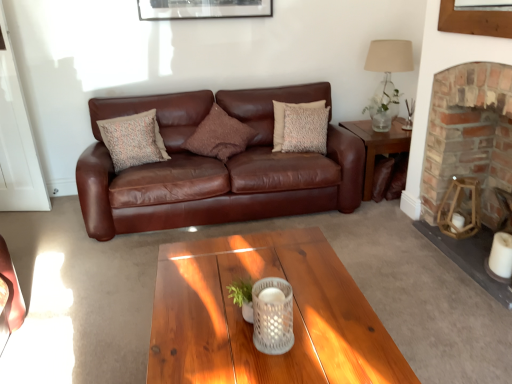
Locate an element on the screen. This screenshot has height=384, width=512. free space in front of wooden side table at right is located at coordinates (380, 224).